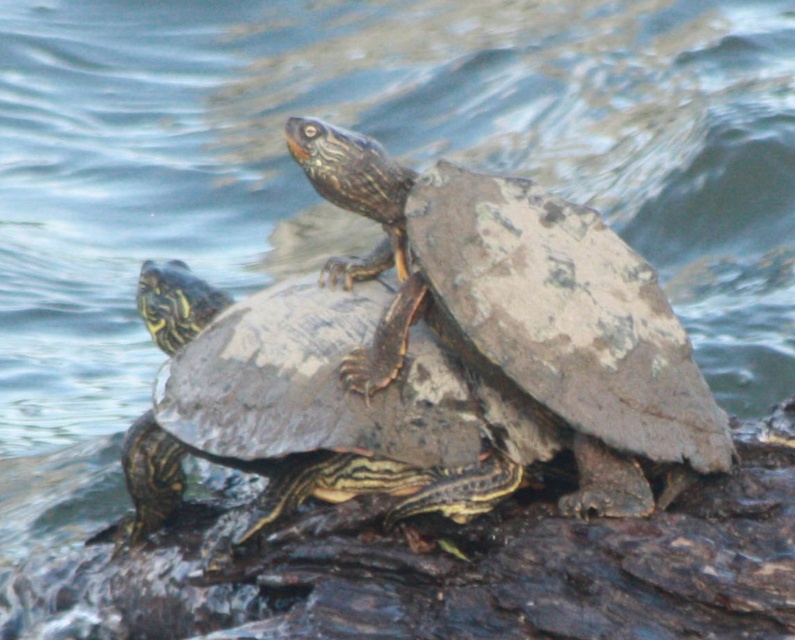
Who is shorter, camouflage-patterned shell at center or patterned shell turtle at center?

Standing shorter between the two is patterned shell turtle at center.

The height and width of the screenshot is (640, 795). What do you see at coordinates (522, 324) in the screenshot?
I see `camouflage-patterned shell at center` at bounding box center [522, 324].

I want to click on camouflage-patterned shell at center, so click(522, 324).